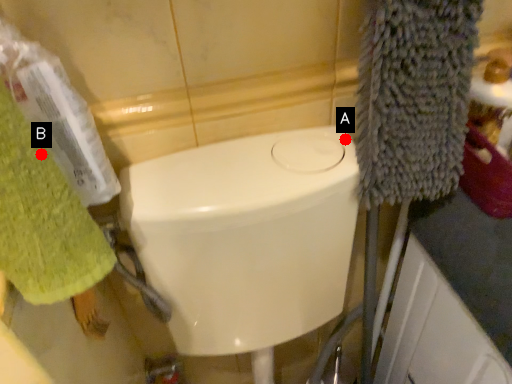
Question: Two points are circled on the image, labeled by A and B beside each circle. Which point appears closest to the camera in this image?

Choices:
 (A) A is closer
 (B) B is closer

Answer: (B)